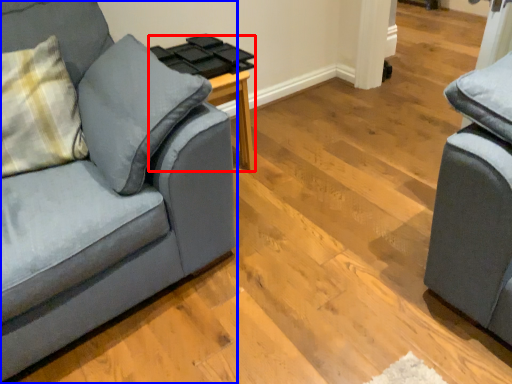
Question: Which of the following is the closest to the observer, side table (highlighted by a red box) or studio couch (highlighted by a blue box)?

Choices:
 (A) side table
 (B) studio couch

Answer: (B)